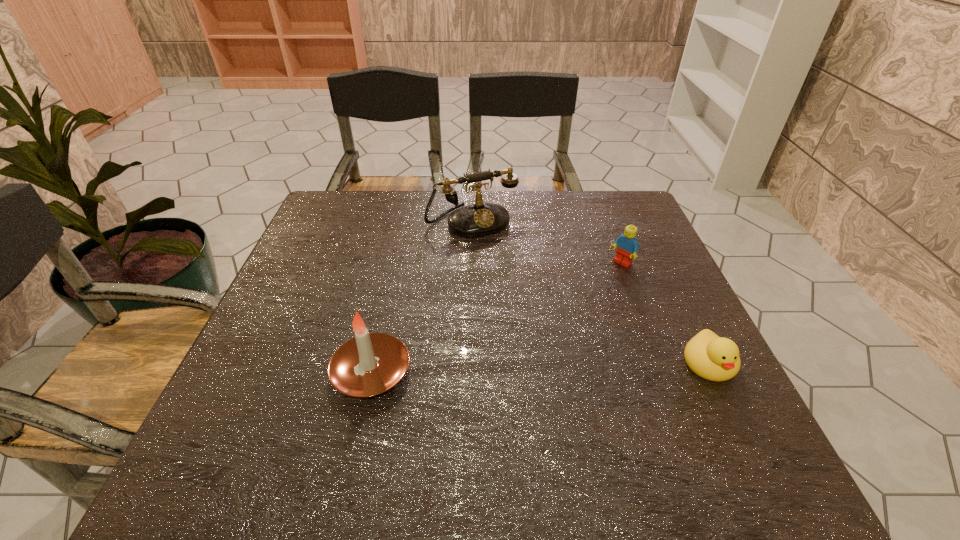
Identify the location of candle. (369, 364).

In order to click on duckling in this screenshot , I will do pyautogui.click(x=711, y=357).

What are the coordinates of `the rightmost object` in the screenshot? It's located at (711, 357).

Image resolution: width=960 pixels, height=540 pixels. I want to click on Lego, so click(627, 247).

The height and width of the screenshot is (540, 960). Find the location of `the second farthest object`. the second farthest object is located at coordinates [627, 247].

Image resolution: width=960 pixels, height=540 pixels. I want to click on the farthest object, so click(x=479, y=219).

This screenshot has height=540, width=960. Identify the location of free location located on the left of the candle. click(292, 372).

Image resolution: width=960 pixels, height=540 pixels. Find the location of `free space located on the face of the second farthest object`. free space located on the face of the second farthest object is located at coordinates (570, 307).

Identify the location of vacant space situated 0.140m on the face of the second farthest object. (583, 297).

This screenshot has width=960, height=540. In order to click on free space located 0.400m on the face of the second farthest object in this screenshot , I will do `click(510, 360)`.